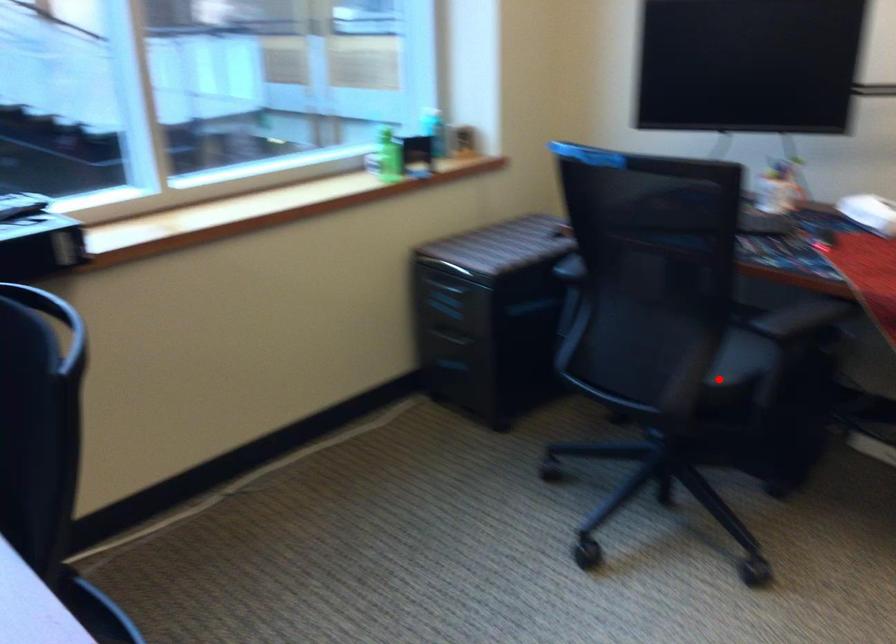
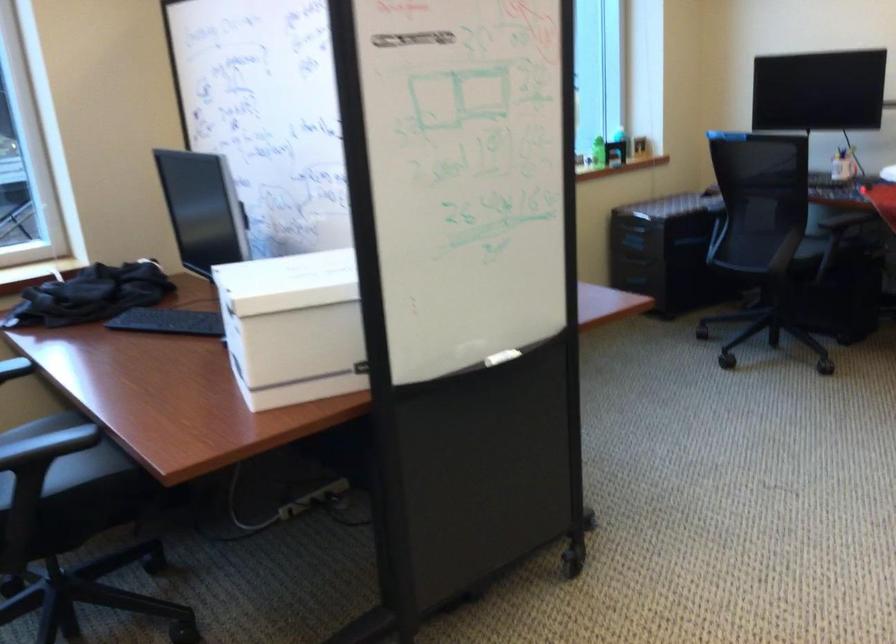
Question: I am providing you with two images of the same scene from different viewpoints. Image1 has a red point marked. In image2, the corresponding 3D location appears at what relative position? Reply with the corresponding letter.

Choices:
 (A) Closer
 (B) Farther

Answer: (B)